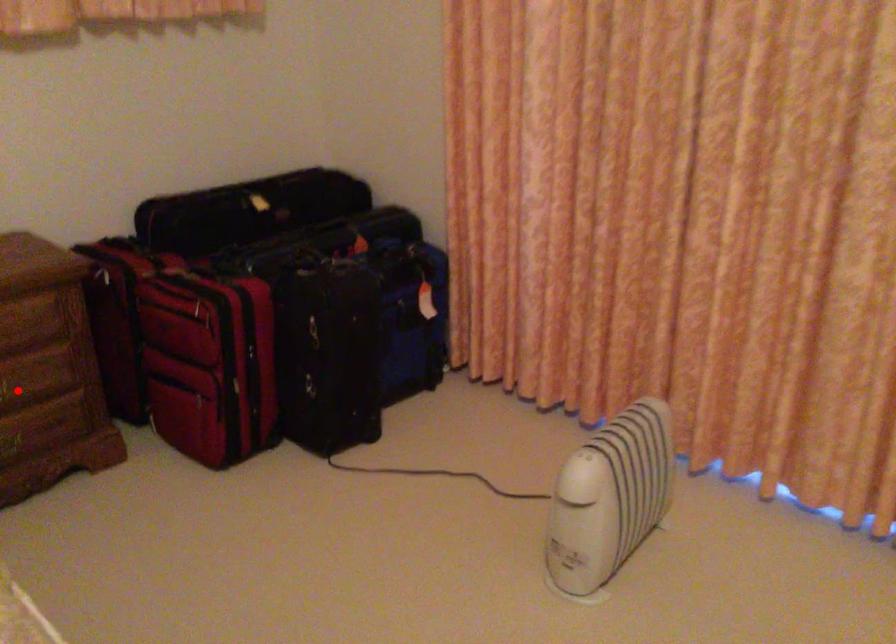
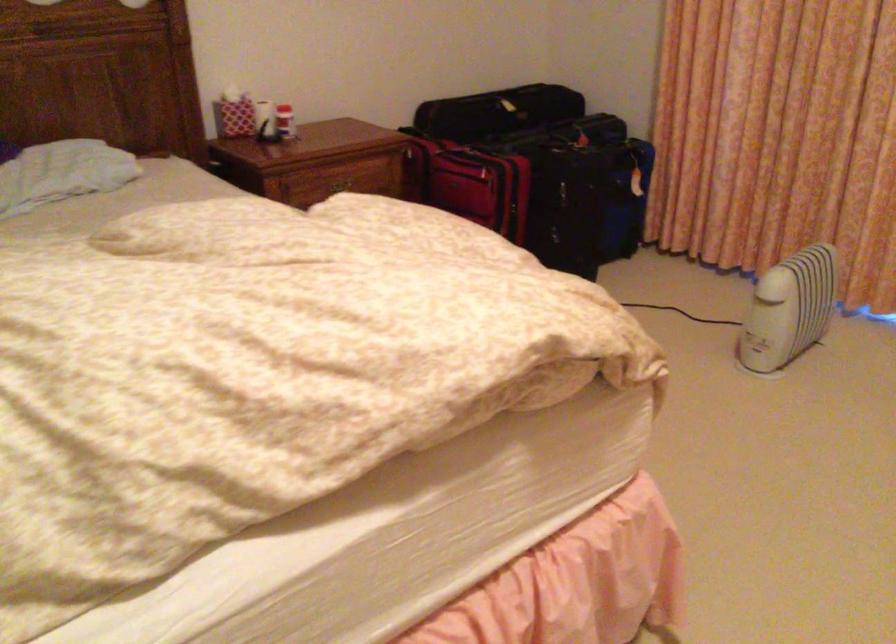
Question: I am providing you with two images of the same scene from different viewpoints. A red point is marked on the first image. Is the red point's position out of view in image 2?

Choices:
 (A) Yes
 (B) No

Answer: (A)